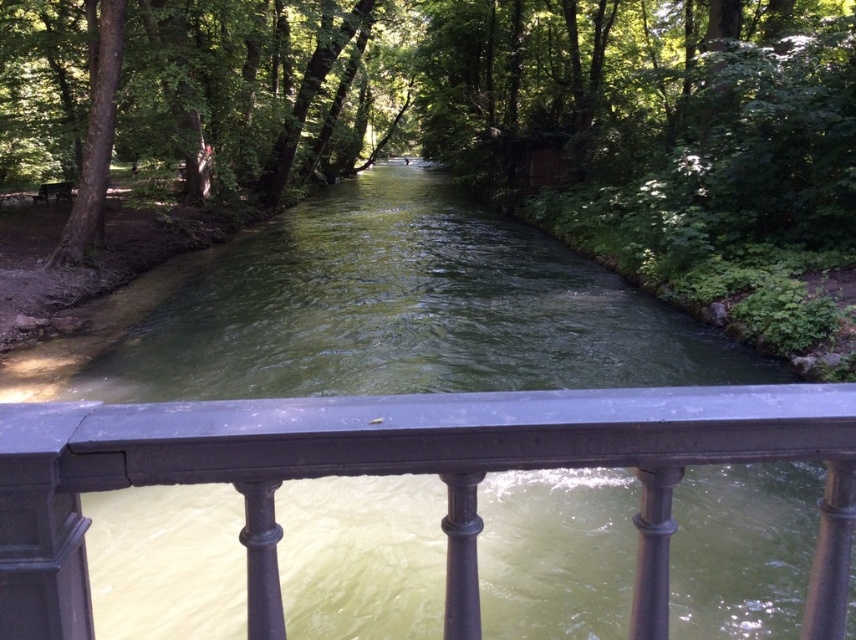
You are standing on the bridge looking at the river. Which green leafy tree is closer to your left side, the green leafy tree at center or the green leafy tree at left?

The green leafy tree at left is closer to your left side because the green leafy tree at center is to the right of it.

You are standing on a bridge overlooking the river and see the green leafy tree at center and the green leafy tree at left. Which tree appears closer to you based on their positions?

The green leafy tree at center appears closer to you because it is positioned above the green leafy tree at left, indicating it is in a more forward layer of the scene.

You are standing on a bridge overlooking the river and want to take a photo of both the black metal railing at center and the green leafy tree at left. Which object should you focus on first to ensure both are in clear view?

You should focus on the black metal railing at center first because it is closer to you than the green leafy tree at left, ensuring both are in clear view when focused properly.